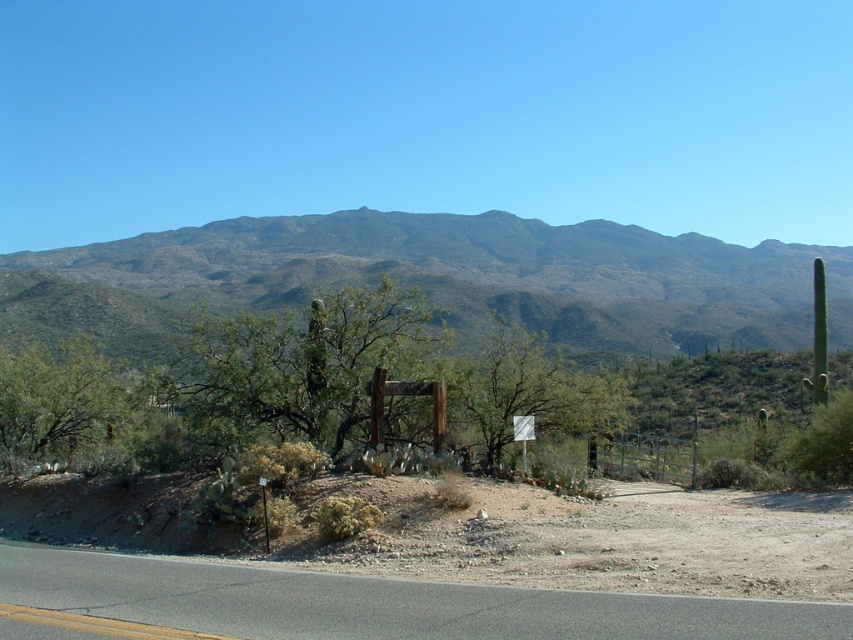
Is point (717, 240) closer to viewer compared to point (439, 604)?

No.

Does green textured mountain range at upper center appear under asphalt road at lower center?

No, green textured mountain range at upper center is not below asphalt road at lower center.

The image size is (853, 640). I want to click on green textured mountain range at upper center, so click(465, 276).

Can you confirm if asphalt road at lower center is taller than white plastic sign at center?

Correct, asphalt road at lower center is much taller as white plastic sign at center.

Who is taller, asphalt road at lower center or white plastic sign at center?

asphalt road at lower center is taller.

Does point (264, 621) come closer to viewer compared to point (531, 436)?

Yes.

At what (x,y) coordinates should I click in order to perform the action: click on asphalt road at lower center. Please return your answer as a coordinate pair (x, y). The width and height of the screenshot is (853, 640). Looking at the image, I should click on (379, 602).

Can you confirm if green textured mountain range at upper center is positioned above white plastic sign at center?

Result: Correct, green textured mountain range at upper center is located above white plastic sign at center.

Measure the distance between green textured mountain range at upper center and camera.

A distance of 19.83 meters exists between green textured mountain range at upper center and camera.

This screenshot has height=640, width=853. In order to click on green textured mountain range at upper center in this screenshot , I will do `click(465, 276)`.